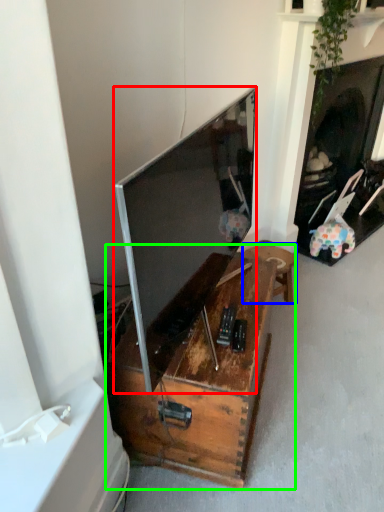
Question: Considering the real-world distances, which object is farthest from television (highlighted by a red box)? furniture (highlighted by a blue box) or table (highlighted by a green box)?

Choices:
 (A) furniture
 (B) table

Answer: (A)